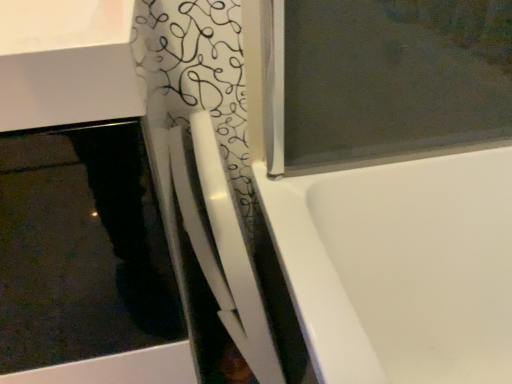
Question: Is point (41, 102) closer or farther from the camera than point (220, 307)?

Choices:
 (A) farther
 (B) closer

Answer: (B)

Question: Looking at their shapes, would you say white glossy sink at upper left is wider or thinner than white glossy shower door at center?

Choices:
 (A) wide
 (B) thin

Answer: (A)

Question: From the image's perspective, is white glossy sink at upper left positioned above or below white glossy shower door at center?

Choices:
 (A) above
 (B) below

Answer: (B)

Question: Is white glossy shower door at center inside the boundaries of white glossy sink at upper left, or outside?

Choices:
 (A) outside
 (B) inside

Answer: (A)

Question: Is white glossy shower door at center in front of or behind white glossy sink at upper left in the image?

Choices:
 (A) front
 (B) behind

Answer: (B)

Question: Is white glossy shower door at center bigger or smaller than white glossy sink at upper left?

Choices:
 (A) small
 (B) big

Answer: (A)

Question: In terms of height, does white glossy shower door at center look taller or shorter compared to white glossy sink at upper left?

Choices:
 (A) tall
 (B) short

Answer: (B)